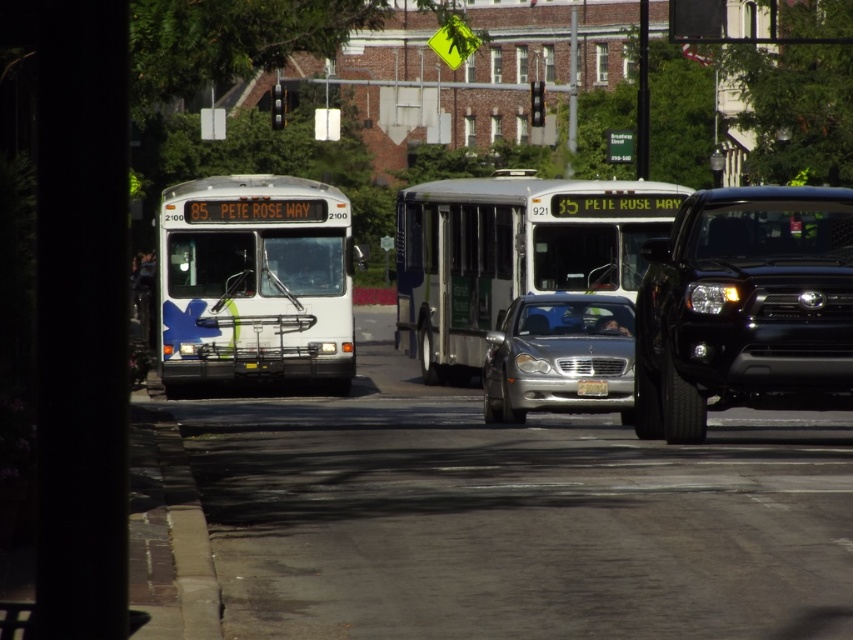
Is silver metallic sedan at center positioned behind yellow matte license plate at center?

That is False.

Does silver metallic sedan at center have a greater width compared to yellow matte license plate at center?

Indeed, silver metallic sedan at center has a greater width compared to yellow matte license plate at center.

Between point (584, 305) and point (577, 390), which one is positioned behind?

Positioned behind is point (584, 305).

Locate an element on the screen. The width and height of the screenshot is (853, 640). silver metallic sedan at center is located at coordinates (560, 356).

Between point (788, 362) and point (612, 339), which one is positioned in front?

Positioned in front is point (788, 362).

Between point (840, 280) and point (547, 410), which one is positioned behind?

Positioned behind is point (547, 410).

Locate an element on the screen. Image resolution: width=853 pixels, height=640 pixels. black matte truck at right is located at coordinates (744, 308).

Can you confirm if black matte truck at right is positioned above yellow matte license plate at center?

Correct, black matte truck at right is located above yellow matte license plate at center.

Can you confirm if black matte truck at right is taller than yellow matte license plate at center?

Indeed, black matte truck at right has a greater height compared to yellow matte license plate at center.

Is point (711, 385) less distant than point (579, 387)?

That is True.

This screenshot has height=640, width=853. In order to click on black matte truck at right in this screenshot , I will do `click(744, 308)`.